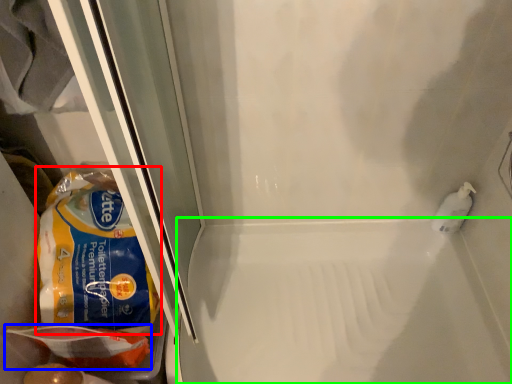
Question: Which object is the closest to the cereal (highlighted by a red box)? Choose among these: food (highlighted by a blue box) or bath (highlighted by a green box).

Choices:
 (A) food
 (B) bath

Answer: (A)